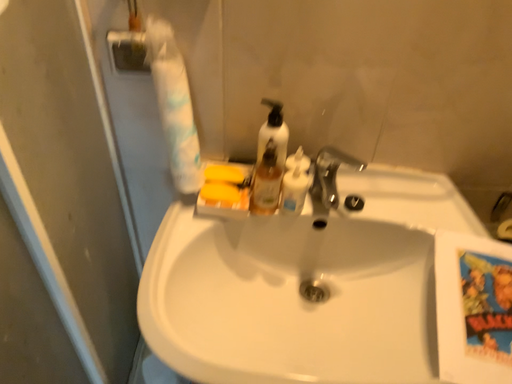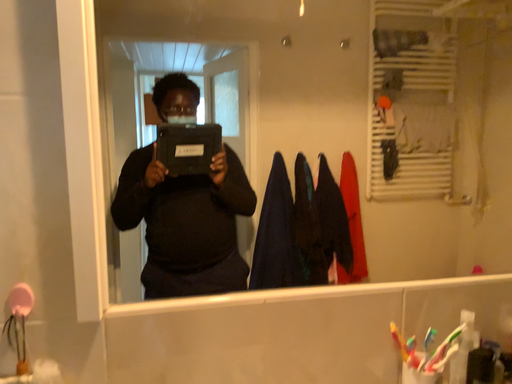
Question: How did the camera likely rotate when shooting the video?

Choices:
 (A) rotated upward
 (B) rotated downward

Answer: (A)